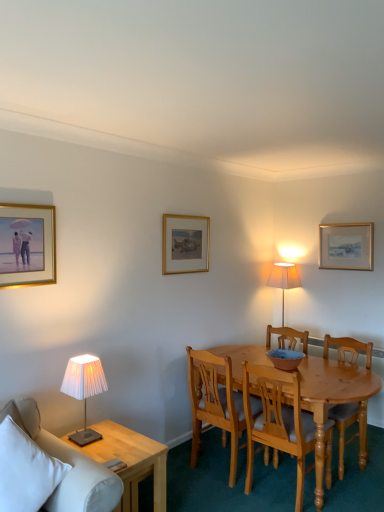
Where is `vacant space to the right of white pleated fabric lampshade at left`? This screenshot has width=384, height=512. vacant space to the right of white pleated fabric lampshade at left is located at coordinates (125, 440).